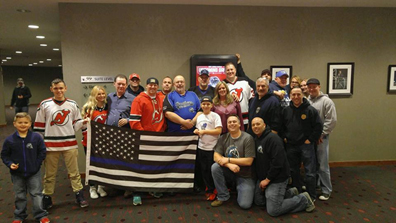
Where is `picture frames`? The image size is (396, 223). picture frames is located at coordinates (393, 86), (343, 79), (285, 69).